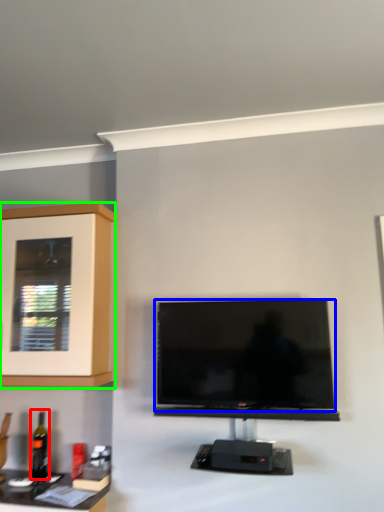
Question: Which is nearer to the bottle (highlighted by a red box)? television (highlighted by a blue box) or cabinetry (highlighted by a green box).

Choices:
 (A) television
 (B) cabinetry

Answer: (B)